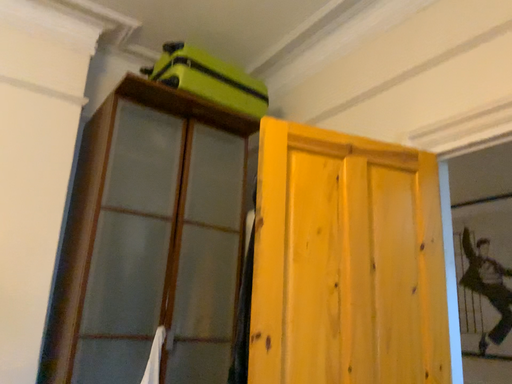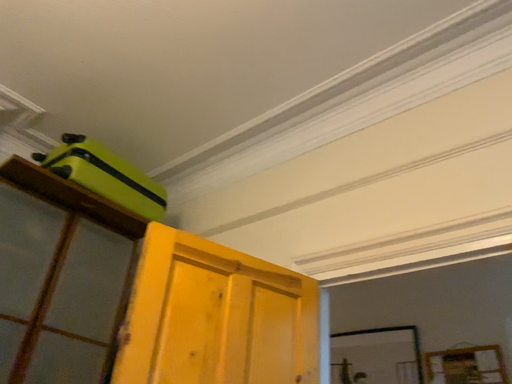
Question: Which way did the camera rotate in the video?

Choices:
 (A) rotated upward
 (B) rotated downward

Answer: (A)